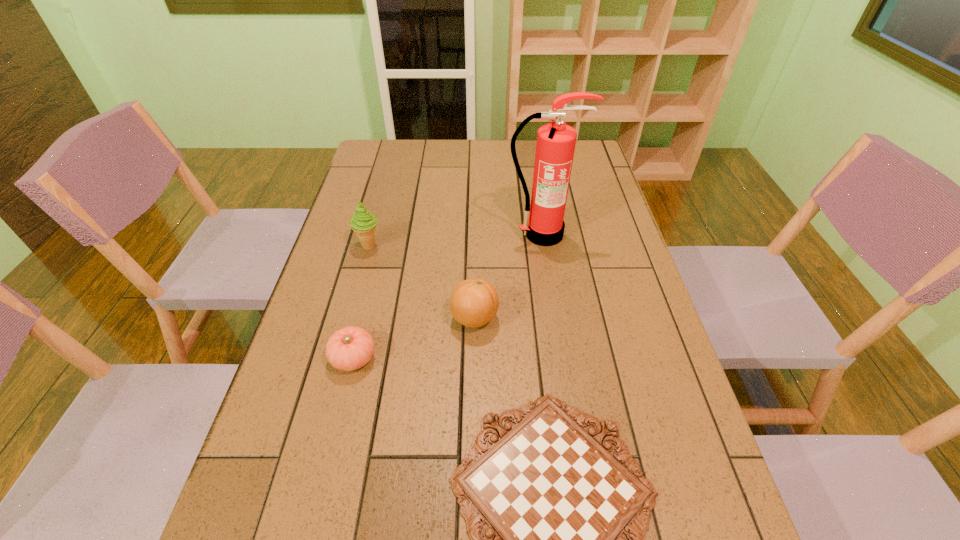
In order to click on icecream that is at the left edge in this screenshot , I will do `click(363, 223)`.

Identify the location of tomato located in the left edge section of the desktop. (350, 348).

Image resolution: width=960 pixels, height=540 pixels. Identify the location of object that is at the right edge. (543, 225).

The width and height of the screenshot is (960, 540). In order to click on blank space at the far edge in this screenshot , I will do `click(532, 172)`.

This screenshot has height=540, width=960. In the image, there is a desktop. What are the coordinates of `vacant space at the left edge` in the screenshot? It's located at (347, 216).

The image size is (960, 540). I want to click on free region at the right edge of the desktop, so click(660, 397).

In the image, there is a desktop. At what (x,y) coordinates should I click in order to perform the action: click on vacant space at the far left corner. Please return your answer as a coordinate pair (x, y). Looking at the image, I should click on (378, 140).

This screenshot has height=540, width=960. I want to click on free space at the far right corner of the desktop, so click(598, 167).

Where is `free point between the third shortest object and the second shortest object`? The image size is (960, 540). free point between the third shortest object and the second shortest object is located at coordinates (414, 338).

The height and width of the screenshot is (540, 960). I want to click on free space between the third shortest object and the fire extinguisher, so click(x=508, y=276).